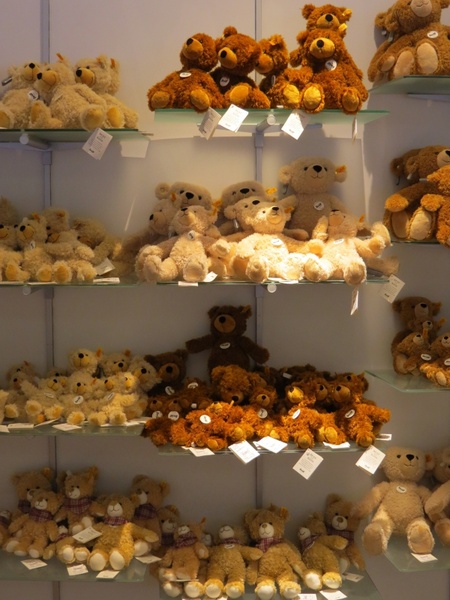
This screenshot has width=450, height=600. What are the coordinates of `glass` in the screenshot? It's located at (405, 386).